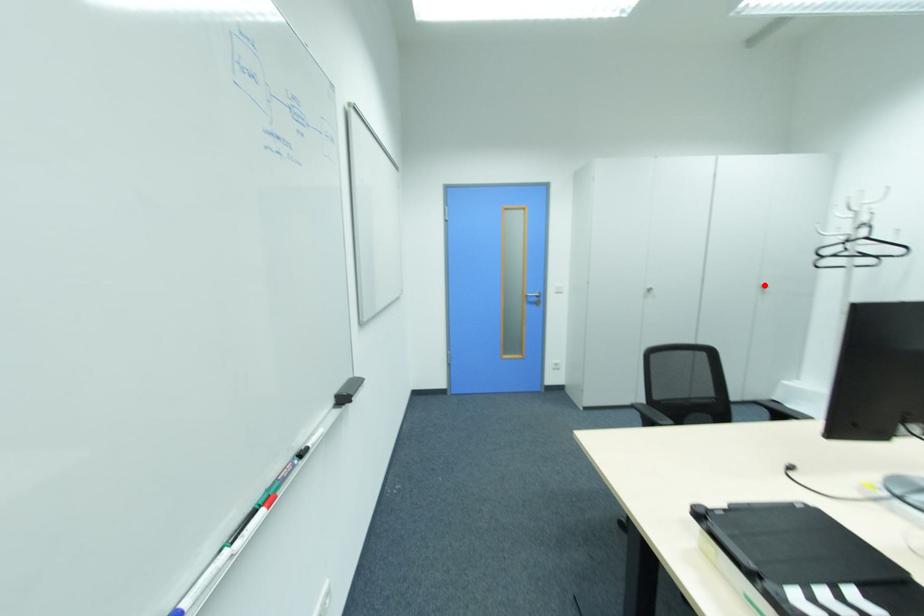
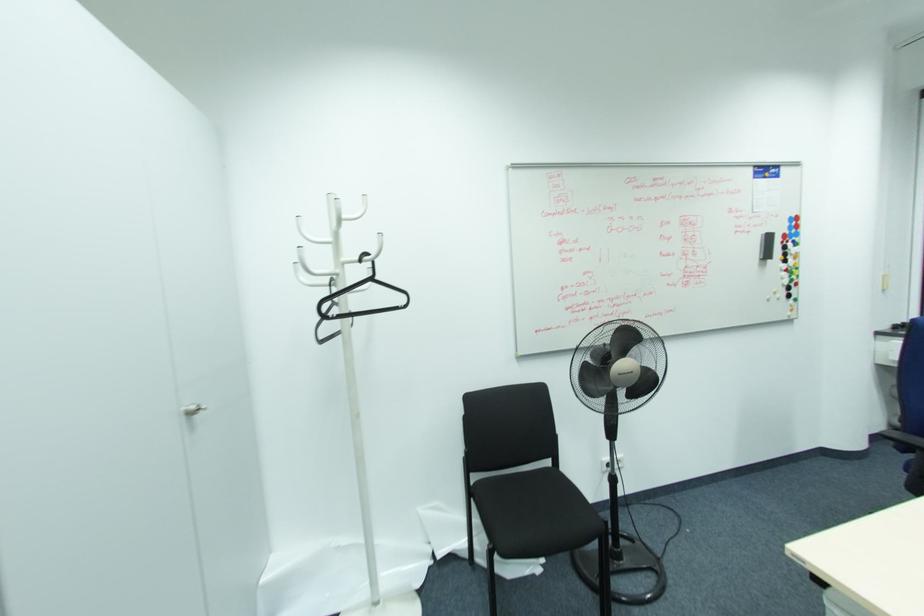
Question: I am providing you with two images of the same scene from different viewpoints. A red point is marked on the first image. Is the red point's position out of view in image 2?

Choices:
 (A) Yes
 (B) No

Answer: (B)